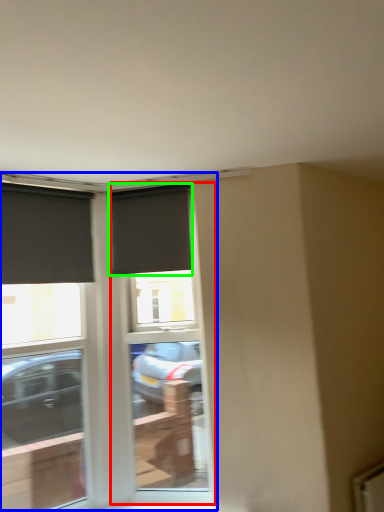
Question: Estimate the real-world distances between objects in this image. Which object is closer to screen door (highlighted by a red box), window (highlighted by a blue box) or window (highlighted by a green box)?

Choices:
 (A) window
 (B) window

Answer: (A)